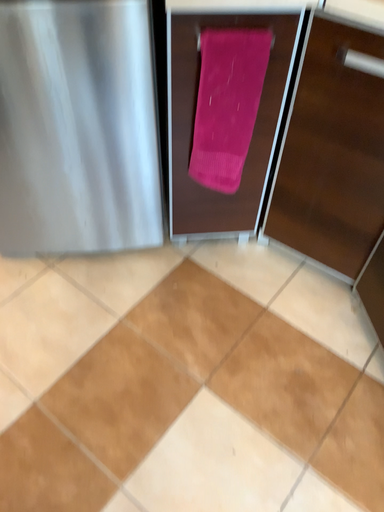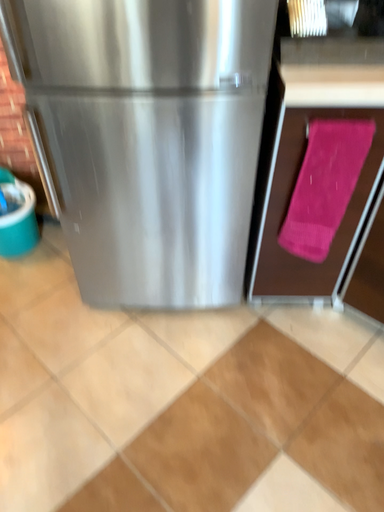
Question: Which way did the camera rotate in the video?

Choices:
 (A) rotated upward
 (B) rotated downward

Answer: (A)